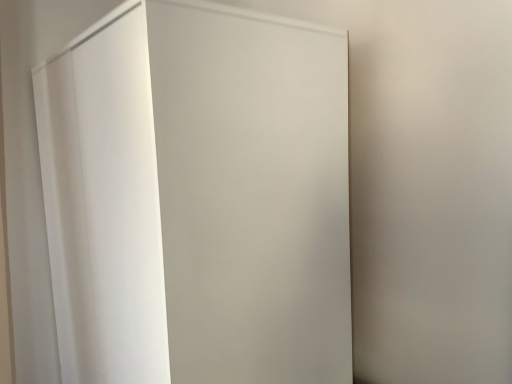
Find the location of a particular element. The image size is (512, 384). white matte door at center is located at coordinates (198, 197).

This screenshot has width=512, height=384. What do you see at coordinates (198, 197) in the screenshot?
I see `white matte door at center` at bounding box center [198, 197].

Where is `white matte door at center`? white matte door at center is located at coordinates (198, 197).